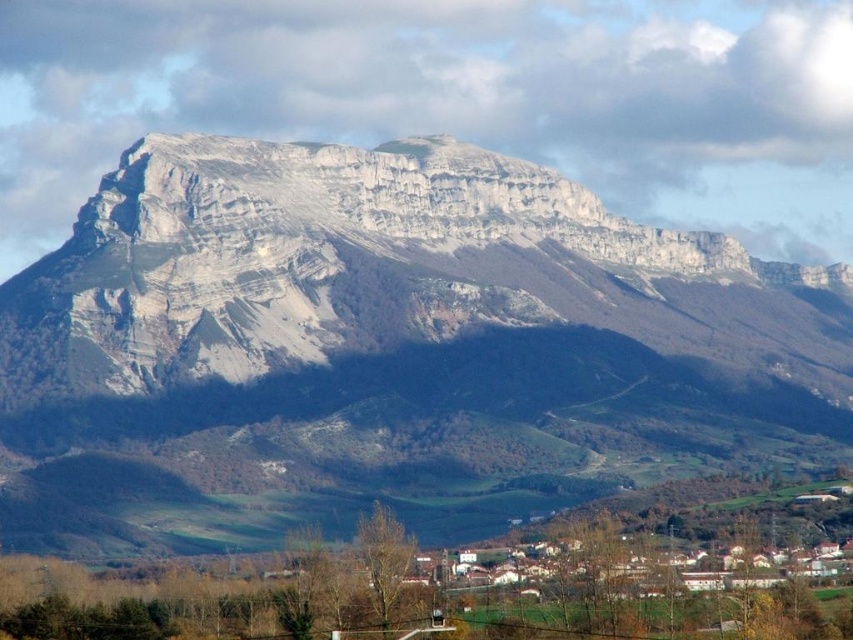
Question: Which object is closer to the camera taking this photo?

Choices:
 (A) white rocky mountain range at upper center
 (B) white matte houses at lower center

Answer: (A)

Question: Is white rocky mountain range at upper center thinner than white matte houses at lower center?

Choices:
 (A) yes
 (B) no

Answer: (B)

Question: Can you confirm if white rocky mountain range at upper center is smaller than white matte houses at lower center?

Choices:
 (A) no
 (B) yes

Answer: (A)

Question: Can you confirm if white rocky mountain range at upper center is bigger than white matte houses at lower center?

Choices:
 (A) yes
 (B) no

Answer: (A)